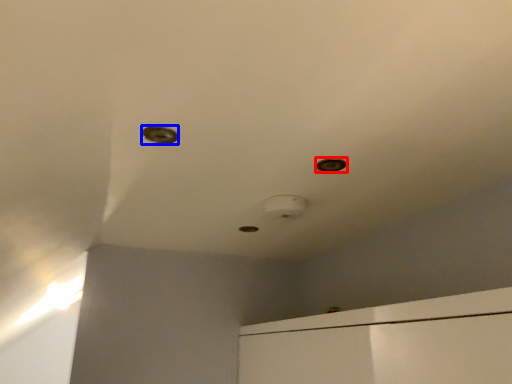
Question: Which object appears farthest to the camera in this image, hole (highlighted by a red box) or hole (highlighted by a blue box)?

Choices:
 (A) hole
 (B) hole

Answer: (A)